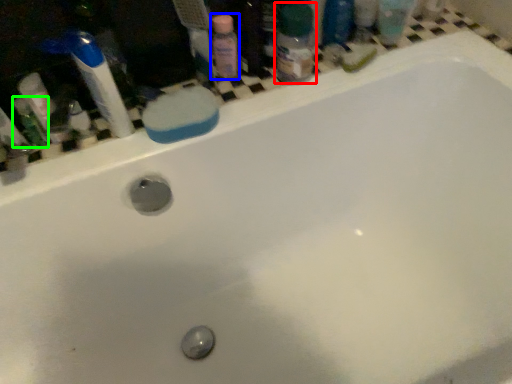
Question: Based on their relative distances, which object is nearer to toiletry (highlighted by a red box)? Choose from cleaning product (highlighted by a blue box) and mouthwash (highlighted by a green box).

Choices:
 (A) cleaning product
 (B) mouthwash

Answer: (A)